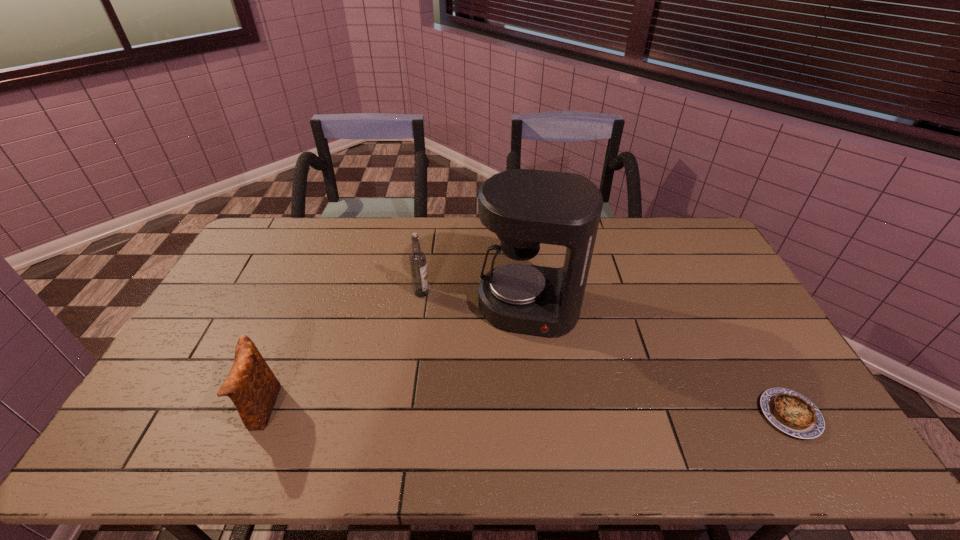
This screenshot has width=960, height=540. What are the coordinates of `object at the right edge` in the screenshot? It's located at (792, 413).

This screenshot has width=960, height=540. Identify the location of object situated at the near right corner. (792, 413).

Image resolution: width=960 pixels, height=540 pixels. Identify the location of vacant region at the far edge of the desktop. (635, 226).

In the image, there is a desktop. What are the coordinates of `free space at the near edge` in the screenshot? It's located at (377, 397).

The image size is (960, 540). In the image, there is a desktop. Identify the location of free region at the left edge. click(223, 283).

You are a GUI agent. You are given a task and a screenshot of the screen. Output one action in this format:
    pyautogui.click(x=<x>, y=<y>)
    Task: Click on the free region at the right edge
    
    Given the screenshot: What is the action you would take?
    pyautogui.click(x=698, y=284)

At what (x,y) coordinates should I click in order to perform the action: click on vacant area at the far left corner. Please return your answer as a coordinate pair (x, y). Looking at the image, I should click on (288, 220).

In the image, there is a desktop. Find the location of `vacant space at the near left corner`. vacant space at the near left corner is located at coordinates (142, 420).

Where is `vacant space that's between the third tallest object and the third shortest object`? vacant space that's between the third tallest object and the third shortest object is located at coordinates (342, 351).

Where is `vacant space in between the third object from right to left and the third tallest object`? This screenshot has width=960, height=540. vacant space in between the third object from right to left and the third tallest object is located at coordinates (342, 351).